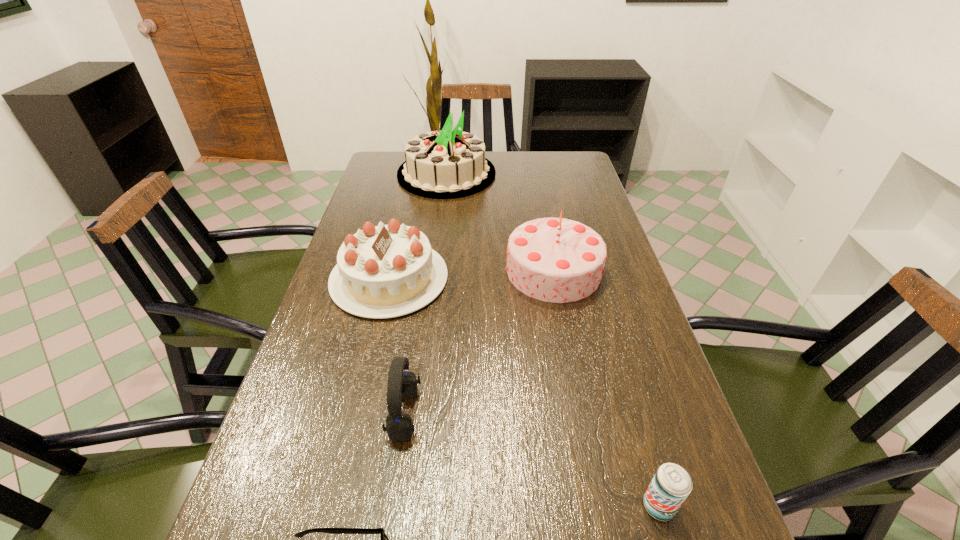
Find the location of a particular element. vacant region that satisfies the following two spatial constraints: 1. on the back side of the farthest birthday cake; 2. on the right side of the shortest birthday cake is located at coordinates (414, 174).